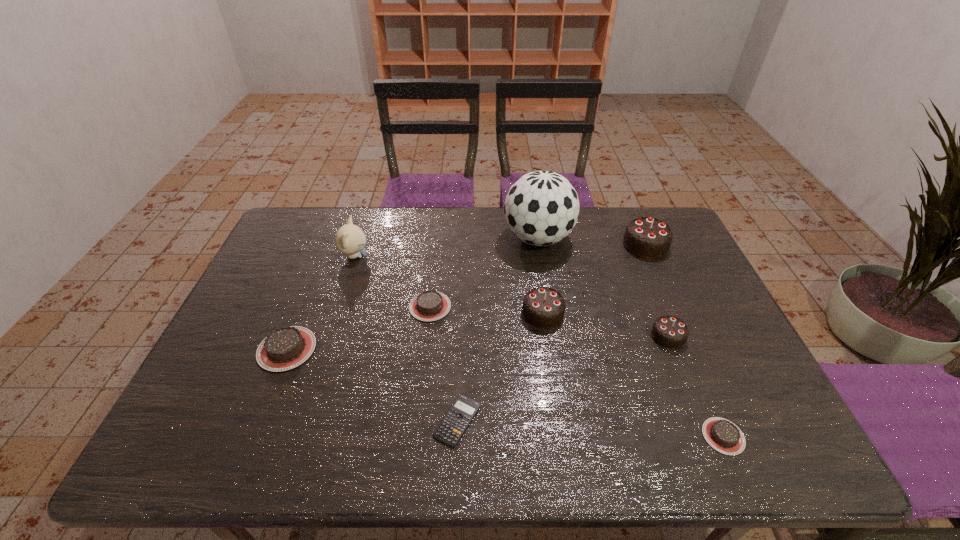
Where is `vacant position located on the back of the smallest chocolate chocolate cake`? The height and width of the screenshot is (540, 960). vacant position located on the back of the smallest chocolate chocolate cake is located at coordinates (649, 288).

Image resolution: width=960 pixels, height=540 pixels. Find the location of `vacant space located on the back of the fourth tallest chocolate cake`. vacant space located on the back of the fourth tallest chocolate cake is located at coordinates (311, 289).

Locate an element on the screen. vacant space located 0.250m on the left of the seventh tallest object is located at coordinates (323, 307).

I want to click on vacant region located on the back of the nearest brown chocolate cake, so click(687, 352).

Where is `free space located on the right of the shortest object`? free space located on the right of the shortest object is located at coordinates (633, 420).

Locate an element on the screen. soccer ball that is at the far edge is located at coordinates coord(541,208).

The width and height of the screenshot is (960, 540). What are the coordinates of `kitten situated at the far edge` in the screenshot? It's located at [350, 239].

Identify the location of chocolate cake positioned at the far edge. (647, 237).

Where is `chocolate cake present at the near edge`? This screenshot has height=540, width=960. chocolate cake present at the near edge is located at coordinates (724, 436).

This screenshot has width=960, height=540. I want to click on calculator that is at the near edge, so click(x=449, y=431).